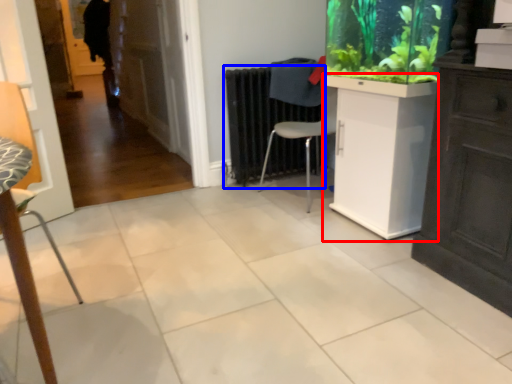
Question: Which object is closer to the camera taking this photo, counter (highlighted by a red box) or radiator (highlighted by a blue box)?

Choices:
 (A) counter
 (B) radiator

Answer: (A)